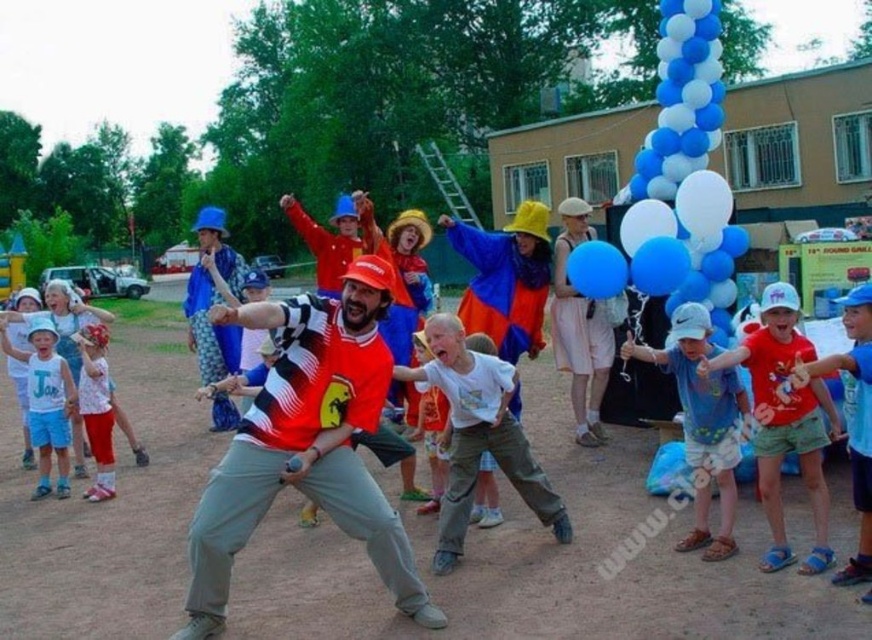
Question: Which object appears closest to the camera in this image?

Choices:
 (A) red and black checkered shirt at center
 (B) matte white shirt at lower left

Answer: (A)

Question: Which point appears closest to the camera in this image?

Choices:
 (A) [x=100, y=410]
 (B) [x=556, y=540]
 (C) [x=229, y=480]

Answer: (C)

Question: Considering the relative positions of blue cotton shorts at lower right and blue glossy balloon at center in the image provided, where is blue cotton shorts at lower right located with respect to blue glossy balloon at center?

Choices:
 (A) above
 (B) below

Answer: (B)

Question: Which point appears farthest from the camera in this image?

Choices:
 (A) (348, 296)
 (B) (59, 445)

Answer: (B)

Question: Does blue cotton shorts at lower right have a lesser width compared to blue glossy balloon at center?

Choices:
 (A) yes
 (B) no

Answer: (A)

Question: Does blue cotton shirt at center have a lesser width compared to matte white shirt at left?

Choices:
 (A) yes
 (B) no

Answer: (A)